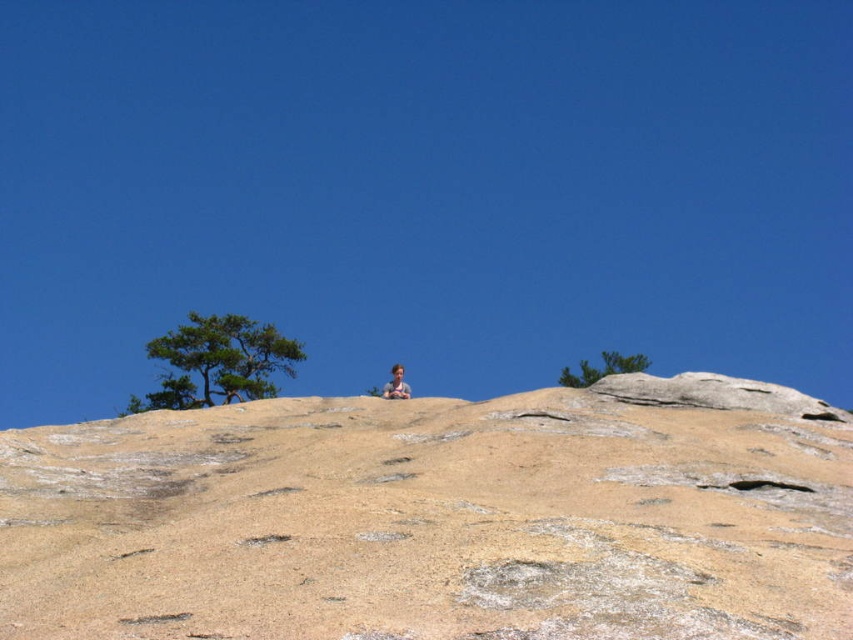
You are a photographer planning to capture a landscape photo that includes both the green leafy tree at upper center and the smooth tan skin at center. Since you want to ensure both subjects are in focus, you need to know their relative sizes. Which object is smaller?

The green leafy tree at upper center is not as tall as smooth tan skin at center, so the green leafy tree at upper center is smaller.

You are standing at the origin point of the coordinate system, which is the bottom left corner of the image. You want to locate the beige rock at center. What are its coordinates?

The beige rock at center is located at coordinates point (438, 516).